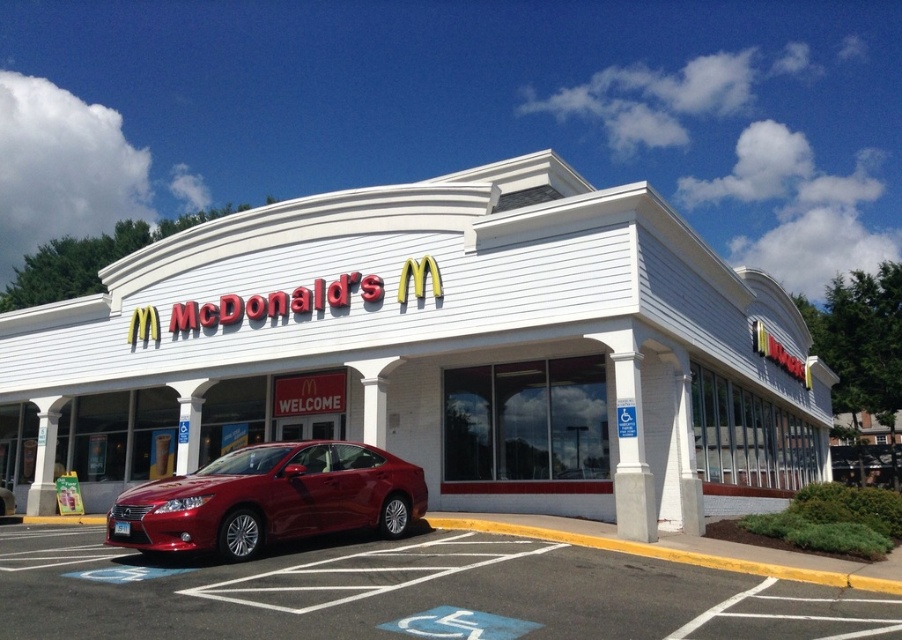
Which is in front, point (790, 460) or point (517, 538)?

Positioned in front is point (517, 538).

This screenshot has height=640, width=902. In order to click on white siding mcdonald's at center in this screenshot , I will do `click(434, 353)`.

Is point (22, 600) positioned after point (388, 513)?

No, (22, 600) is in front of (388, 513).

This screenshot has width=902, height=640. Describe the element at coordinates (408, 593) in the screenshot. I see `smooth asphalt parking lot at lower center` at that location.

Which is behind, point (603, 627) or point (308, 456)?

Point (308, 456)

Image resolution: width=902 pixels, height=640 pixels. I want to click on smooth asphalt parking lot at lower center, so click(x=408, y=593).

Between point (548, 502) and point (210, 468), which one is positioned behind?

Point (548, 502)

Does white siding mcdonald's at center appear on the right side of glossy metallic sedan at center?

Correct, you'll find white siding mcdonald's at center to the right of glossy metallic sedan at center.

Is point (476, 244) closer to viewer compared to point (253, 506)?

No, (476, 244) is behind (253, 506).

I want to click on white siding mcdonald's at center, so click(x=434, y=353).